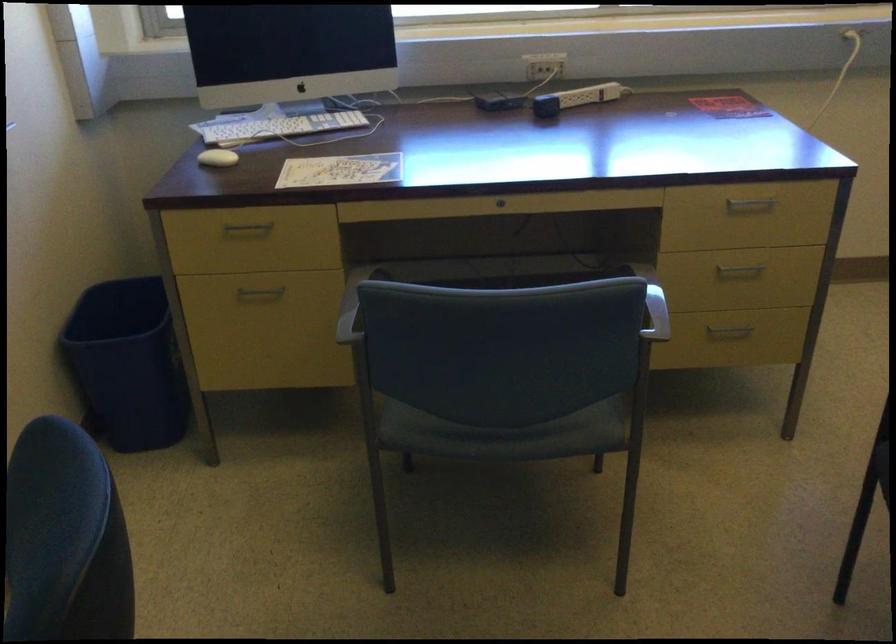
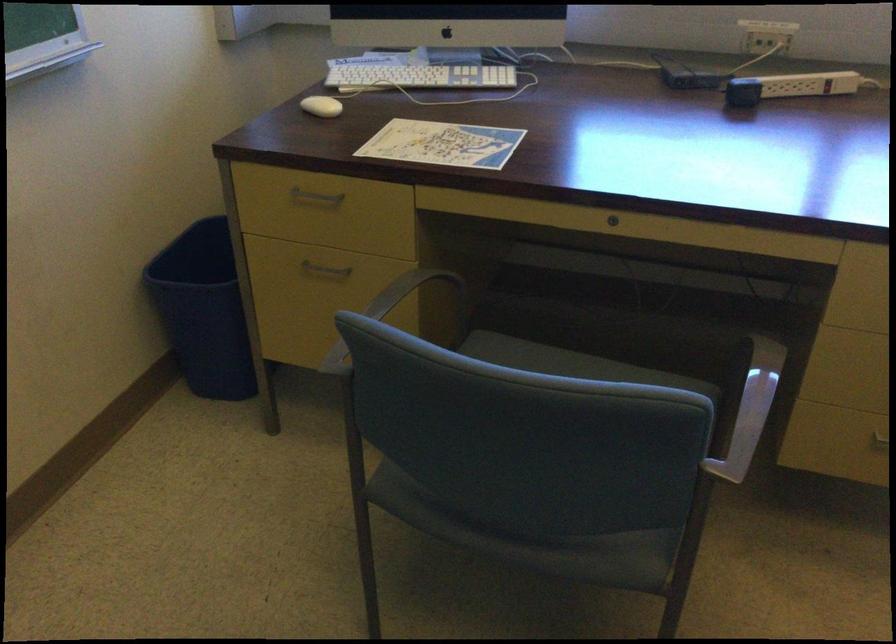
In the second image, find the point that corresponds to (261,292) in the first image.

(324, 269)